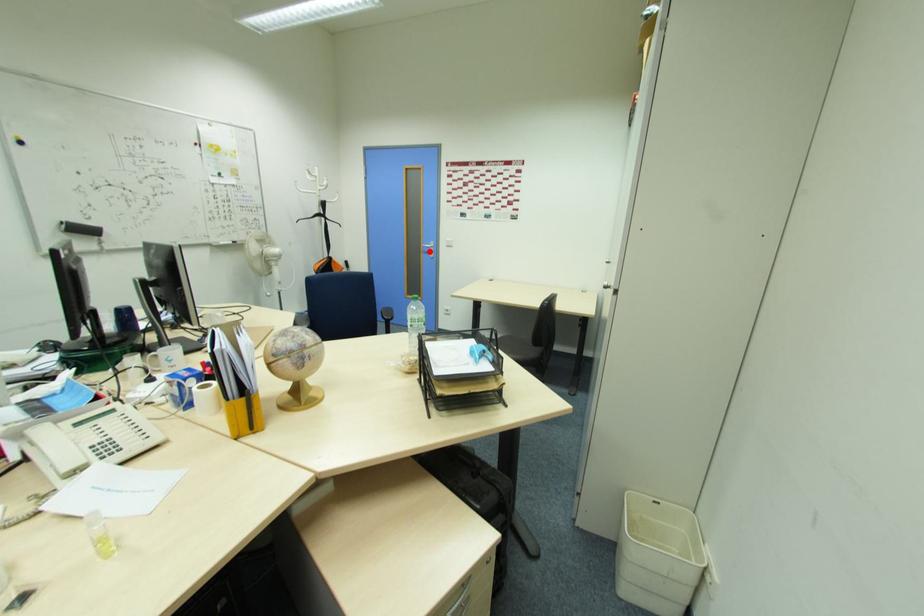
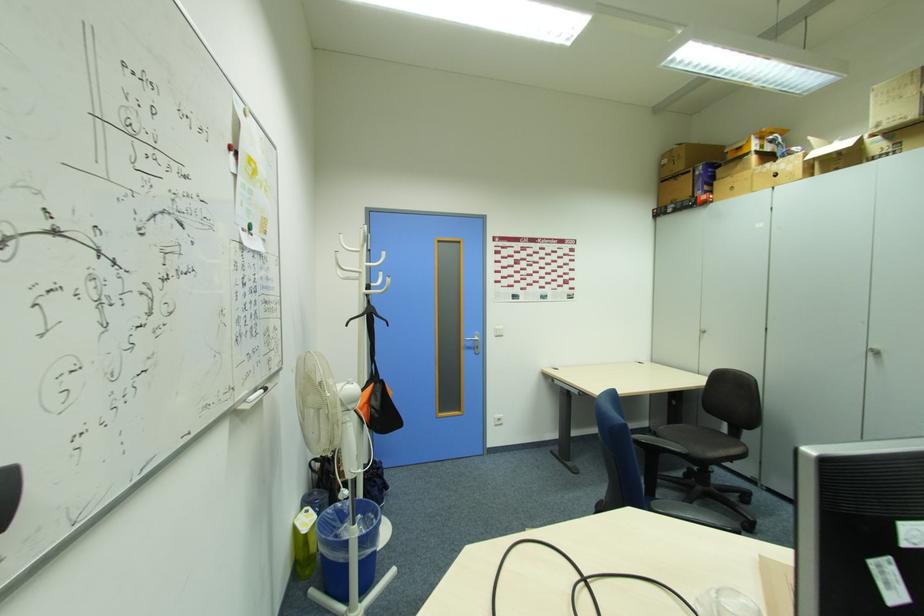
Question: I am providing you with two images of the same scene from different viewpoints. Given a red point in image1, look at the same physical point in image2. Is it:

Choices:
 (A) Closer to the viewpoint
 (B) Farther from the viewpoint

Answer: (B)